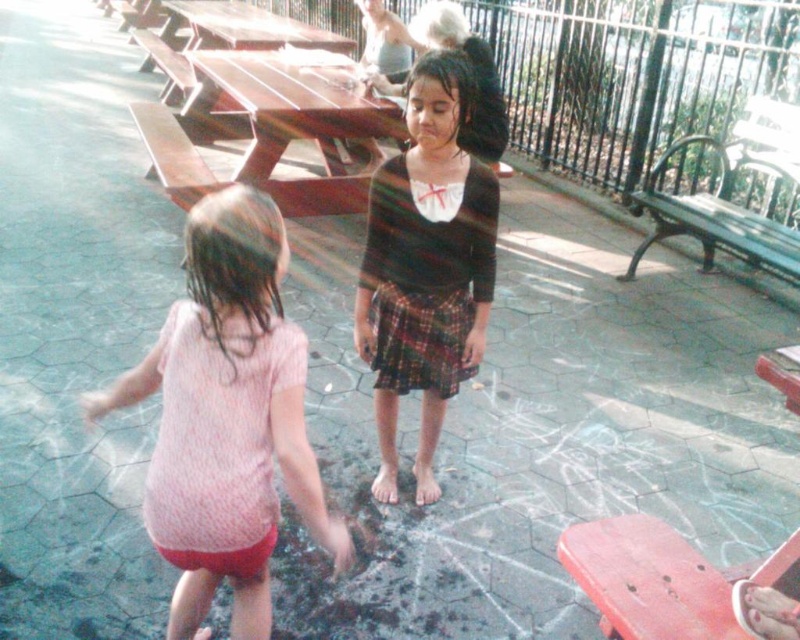
Question: Estimate the real-world distances between objects in this image. Which object is farther from the striped knit sweater at center?

Choices:
 (A) brown wooden picnic table at center
 (B) pink fabric shirt at center

Answer: (A)

Question: Is striped knit sweater at center further to camera compared to brown wooden picnic table at center?

Choices:
 (A) no
 (B) yes

Answer: (A)

Question: Is pink fabric shirt at center to the right of striped knit sweater at center from the viewer's perspective?

Choices:
 (A) no
 (B) yes

Answer: (A)

Question: Does striped knit sweater at center have a greater width compared to brown wooden picnic table at center?

Choices:
 (A) no
 (B) yes

Answer: (A)

Question: Which object appears closest to the camera in this image?

Choices:
 (A) brown wooden picnic table at center
 (B) pink fabric shirt at center

Answer: (B)

Question: Estimate the real-world distances between objects in this image. Which object is closer to the brown wooden picnic table at center?

Choices:
 (A) striped knit sweater at center
 (B) pink fabric shirt at center

Answer: (A)